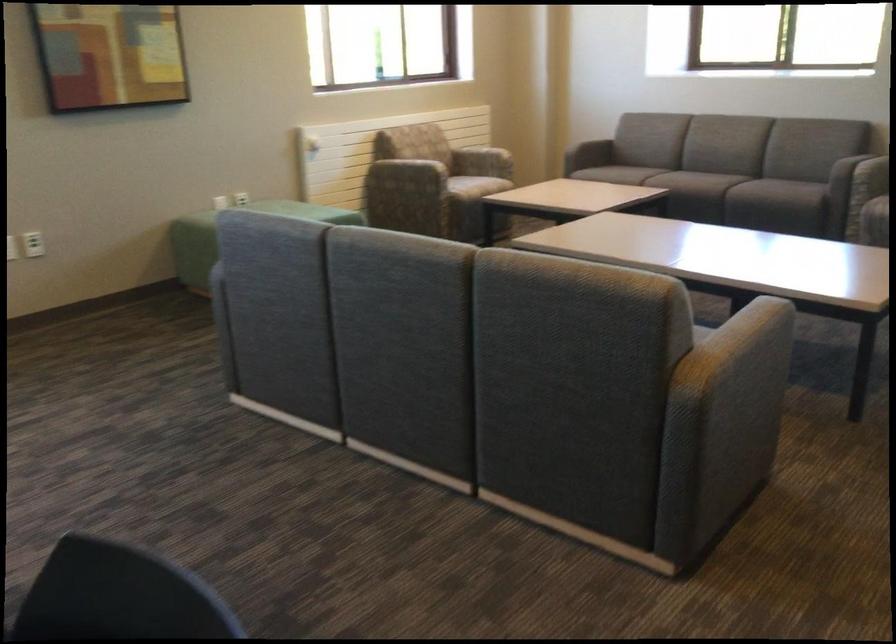
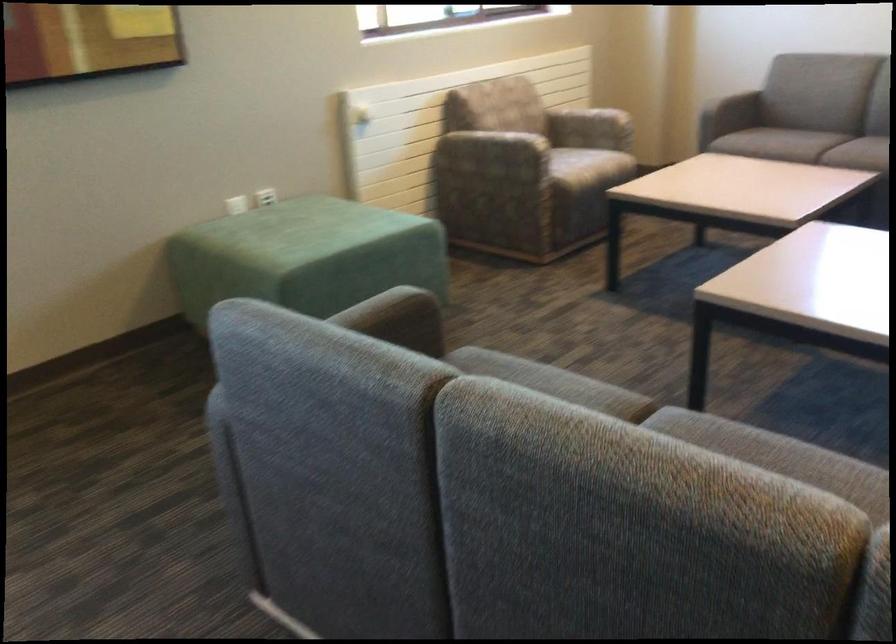
Question: What movement of the cameraman would produce the second image?

Choices:
 (A) Left
 (B) Right
 (C) Forward
 (D) Backward

Answer: (C)